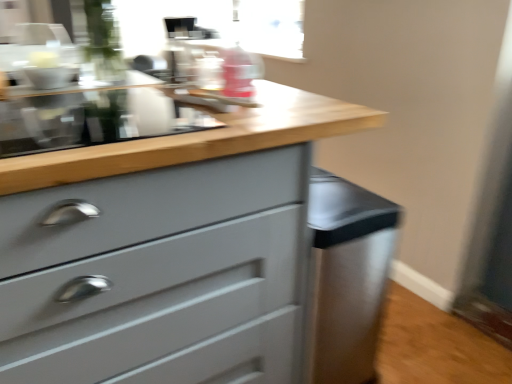
Find the location of a particular element. This screenshot has height=384, width=512. empty space that is ontop of satin silver cabinet at lower right (from a real-world perspective) is located at coordinates (331, 193).